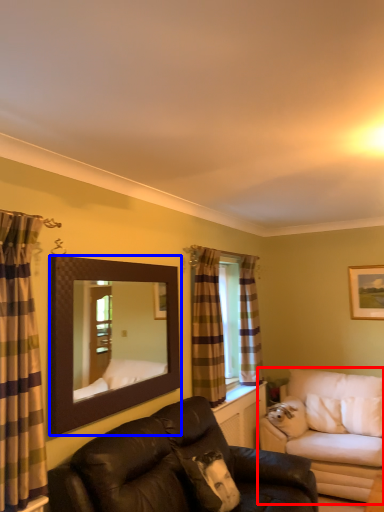
Question: Which of the following is the farthest to the observer, studio couch (highlighted by a red box) or mirror (highlighted by a blue box)?

Choices:
 (A) studio couch
 (B) mirror

Answer: (A)